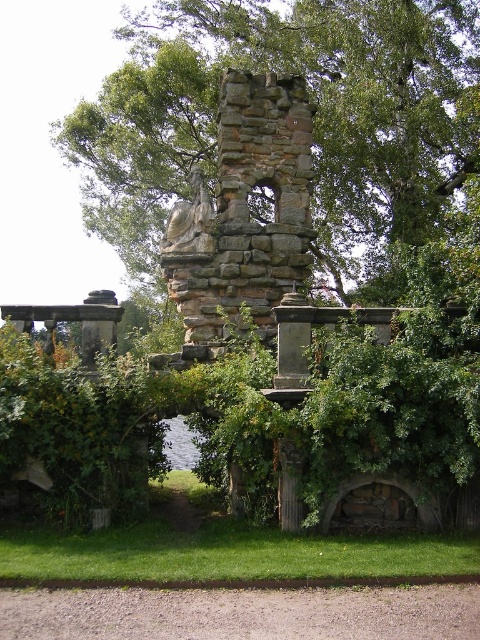
Does green leafy tree at center appear on the right side of rustic stone chimney at center?

Incorrect, green leafy tree at center is not on the right side of rustic stone chimney at center.

Which of these two, green leafy tree at center or rustic stone chimney at center, stands taller?

With more height is green leafy tree at center.

This screenshot has height=640, width=480. I want to click on green leafy tree at center, so click(314, 116).

What are the coordinates of `green leafy tree at center` in the screenshot? It's located at (314, 116).